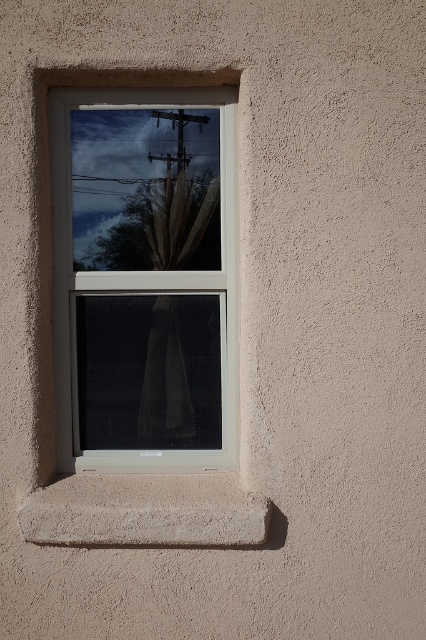
Question: Is smooth concrete window sill at lower center wider than white sheer curtain at center?

Choices:
 (A) yes
 (B) no

Answer: (A)

Question: Which object appears farthest from the camera in this image?

Choices:
 (A) white sheer curtain at center
 (B) smooth concrete window sill at lower center
 (C) white plastic window frame at center

Answer: (A)

Question: Which of the following is the farthest from the observer?

Choices:
 (A) white sheer curtain at center
 (B) white plastic window frame at center
 (C) smooth concrete window sill at lower center

Answer: (A)

Question: Is smooth concrete window sill at lower center closer to camera compared to white sheer curtain at center?

Choices:
 (A) no
 (B) yes

Answer: (B)

Question: Is white plastic window frame at center to the right of white sheer curtain at center from the viewer's perspective?

Choices:
 (A) yes
 (B) no

Answer: (B)

Question: Which object is closer to the camera taking this photo?

Choices:
 (A) smooth concrete window sill at lower center
 (B) white plastic window frame at center
 (C) white sheer curtain at center

Answer: (A)